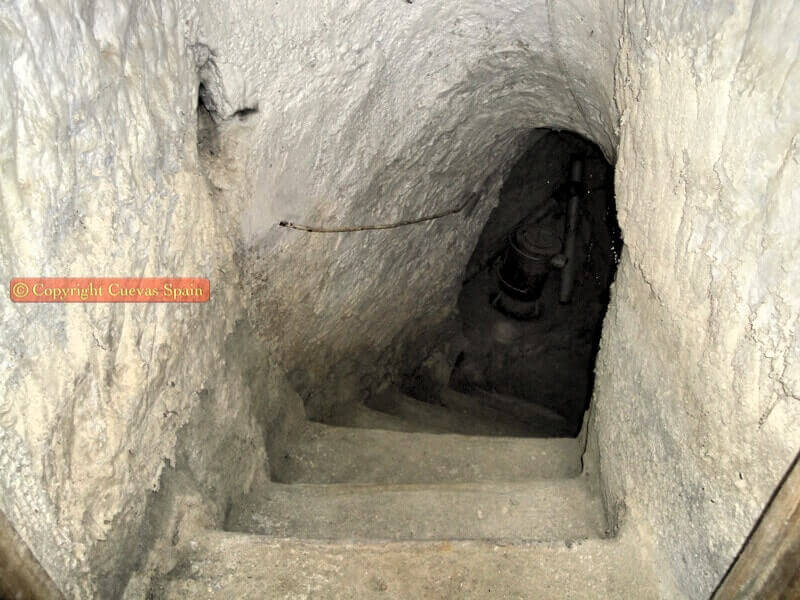
You are a GUI agent. You are given a task and a screenshot of the screen. Output one action in this format:
    pyautogui.click(x=<x>, y=<y>)
    Task: Click on the stairs
    The height and width of the screenshot is (600, 800).
    Given the screenshot: What is the action you would take?
    pyautogui.click(x=360, y=569)